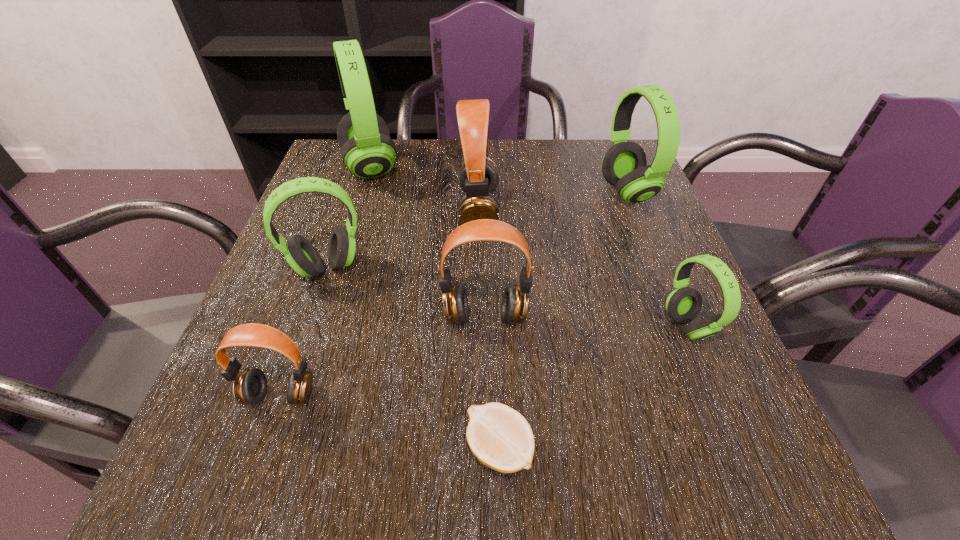
Where is `free point that satisfies the following two spatial constraints: 1. on the ear cups of the yellow lemon; 2. on the left side of the second nearest object`? free point that satisfies the following two spatial constraints: 1. on the ear cups of the yellow lemon; 2. on the left side of the second nearest object is located at coordinates (262, 449).

Where is `free space that satisfies the following two spatial constraints: 1. on the front side of the yellow lemon; 2. on the right side of the fourth nearest headset`? The height and width of the screenshot is (540, 960). free space that satisfies the following two spatial constraints: 1. on the front side of the yellow lemon; 2. on the right side of the fourth nearest headset is located at coordinates (266, 449).